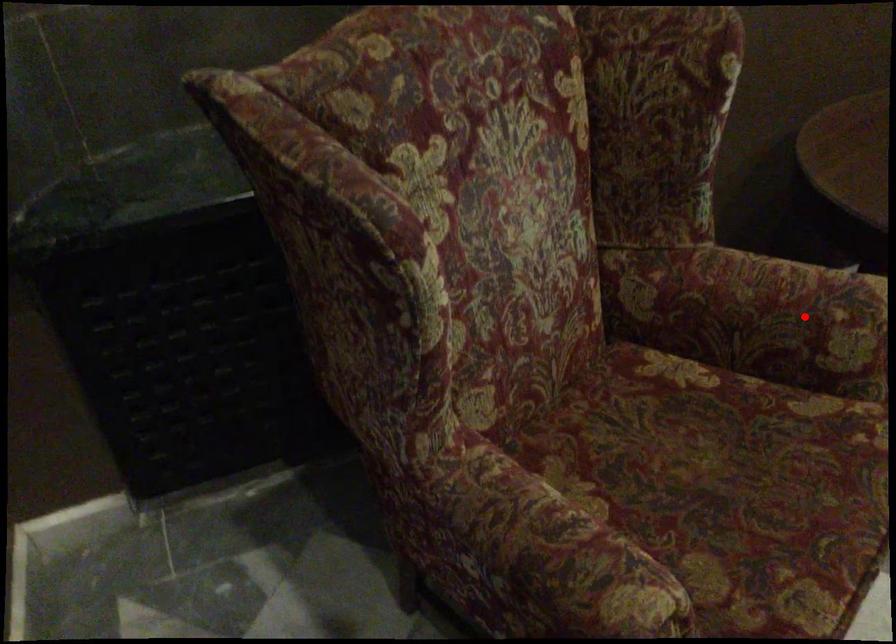
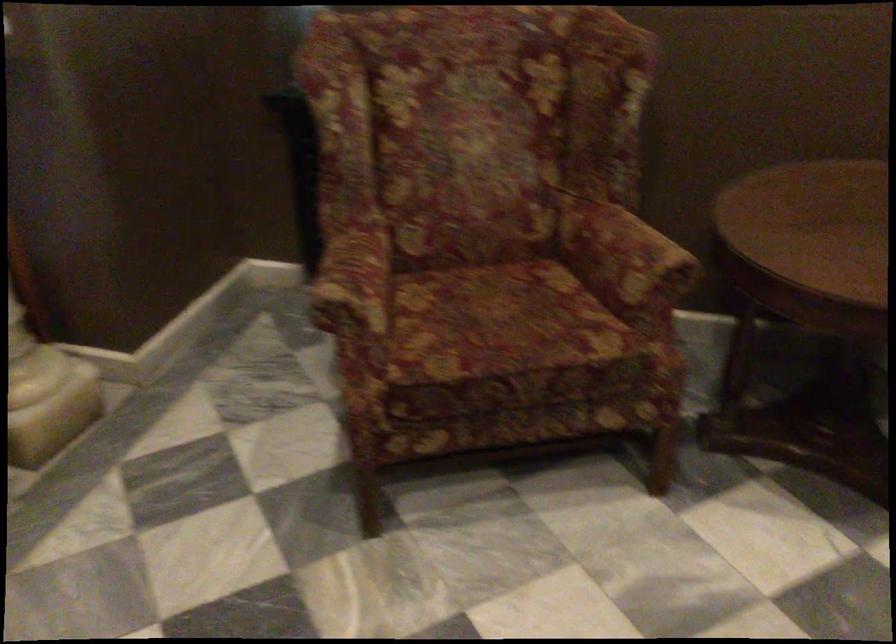
Question: I am providing you with two images of the same scene from different viewpoints. Given a red point in image1, look at the same physical point in image2. Is it:

Choices:
 (A) Closer to the viewpoint
 (B) Farther from the viewpoint

Answer: (B)